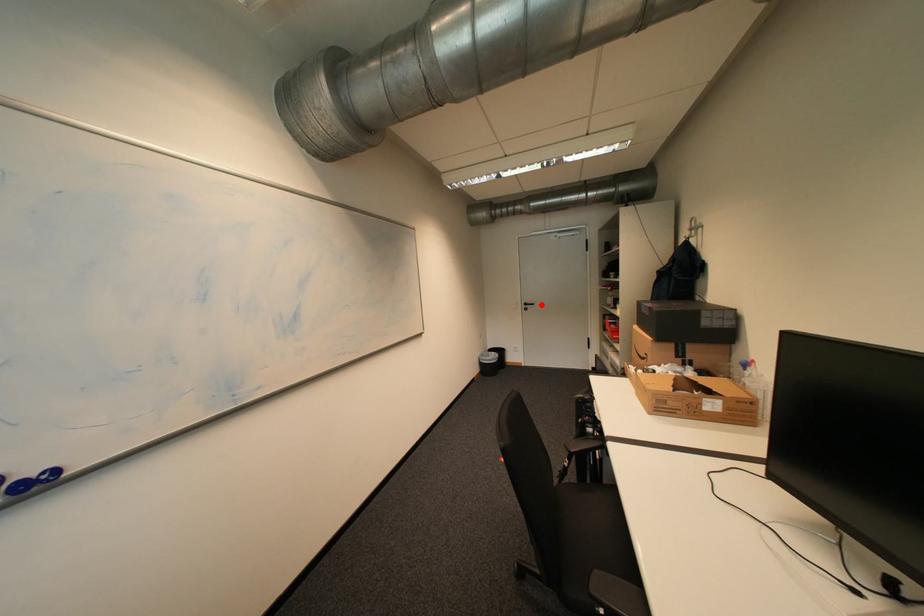
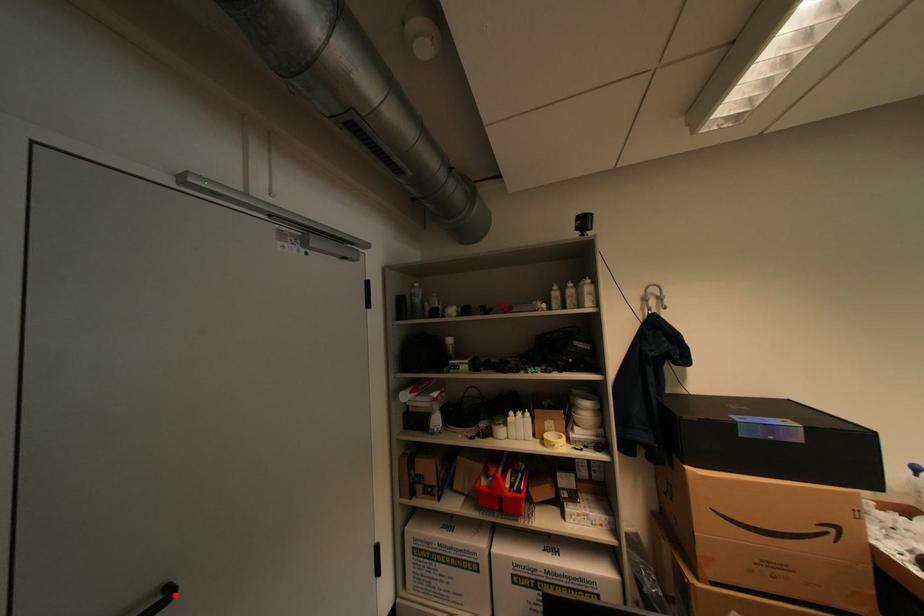
I am providing you with two images of the same scene from different viewpoints. A red point is marked on the first image and another point is marked on the second image. Does the point marked in image1 correspond to the same location as the one in image2?

Yes